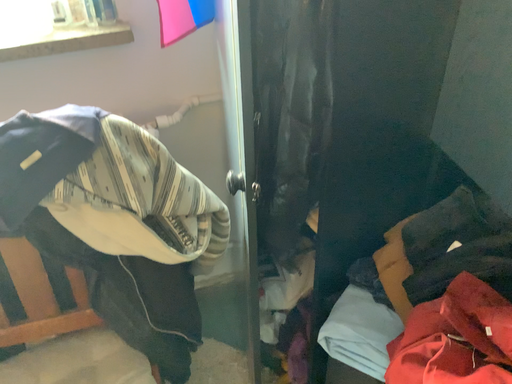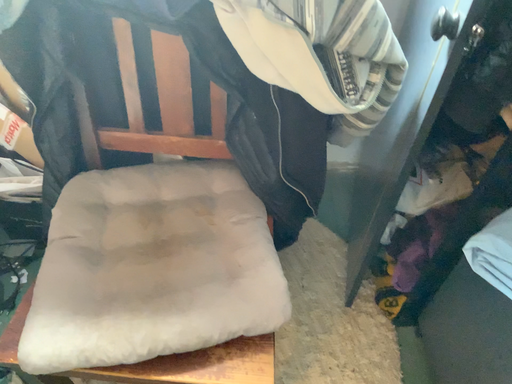
Question: Which way did the camera rotate in the video?

Choices:
 (A) rotated upward
 (B) rotated downward

Answer: (B)